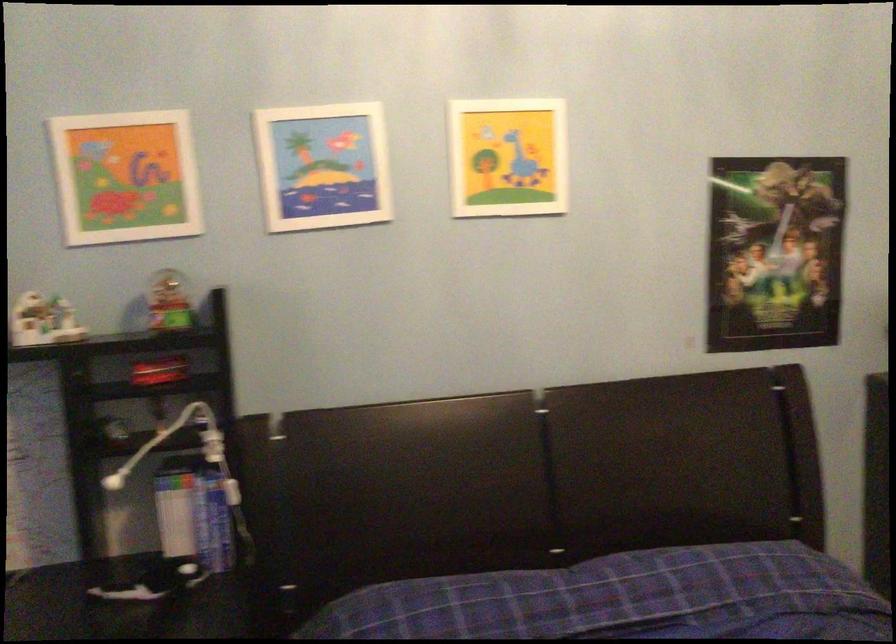
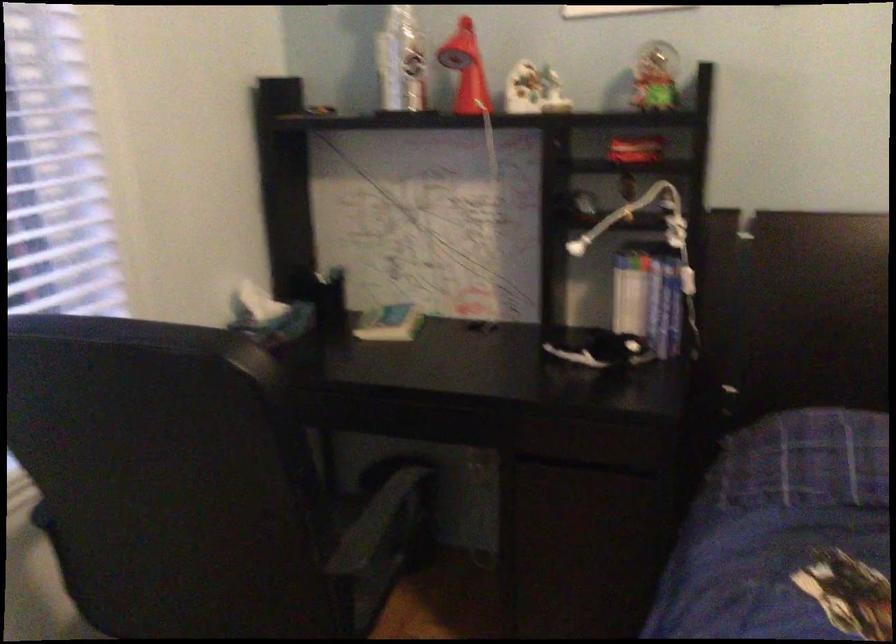
Find the pixel in the second image that matches the point at 212,522 in the first image.

(664, 307)